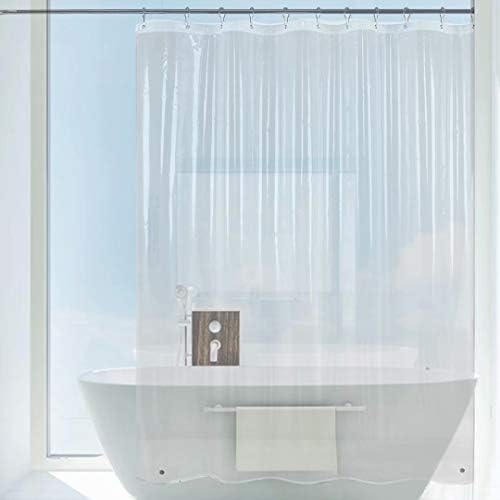
Find the location of a particular element. The height and width of the screenshot is (500, 500). towel is located at coordinates (279, 443).